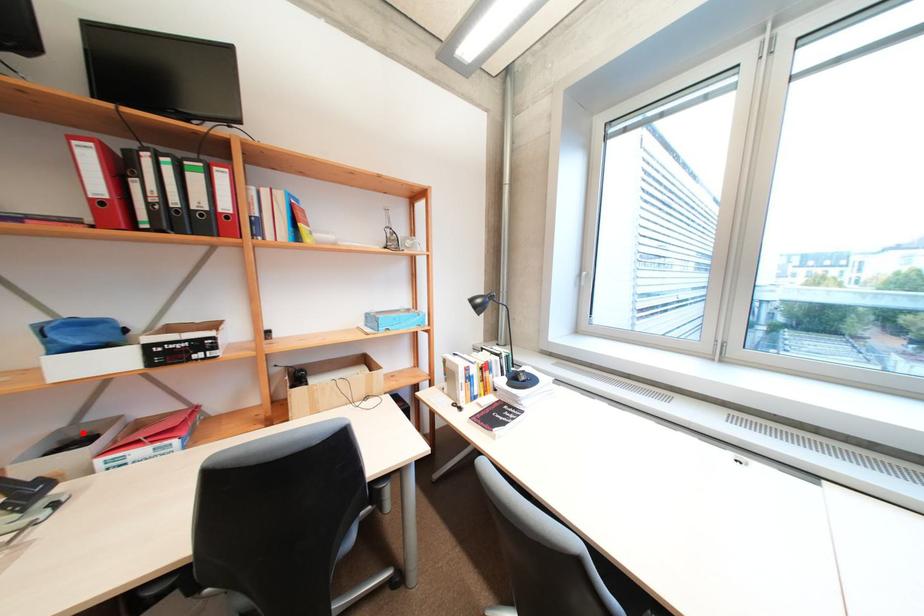
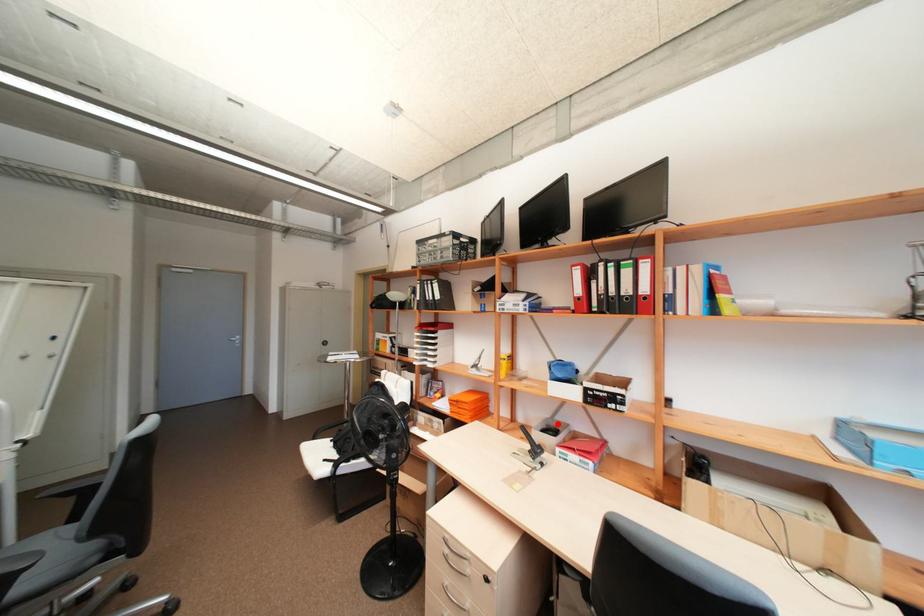
I am providing you with two images of the same scene from different viewpoints. A red point is marked on the first image and another point is marked on the second image. Is the red point in image1 aligned with the point shown in image2?

Yes